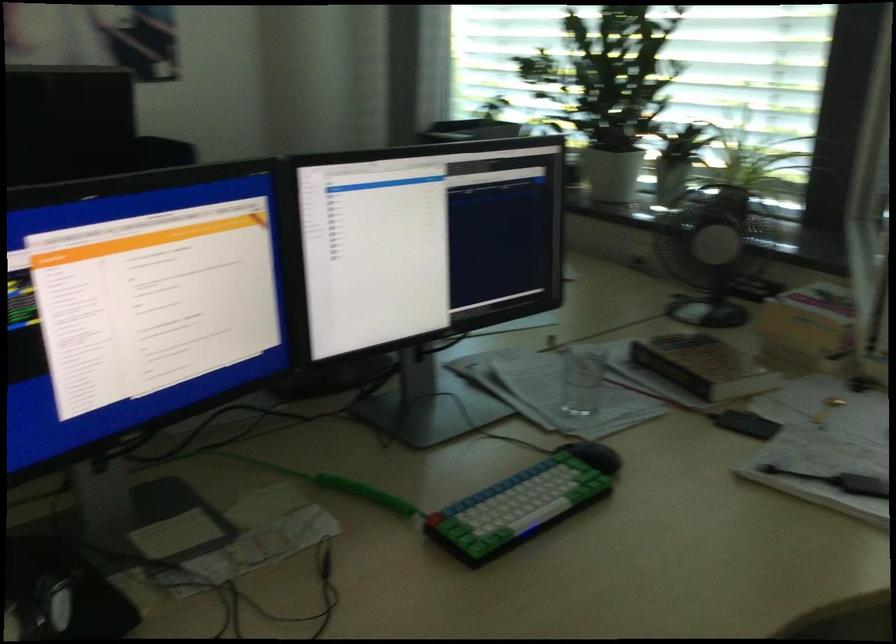
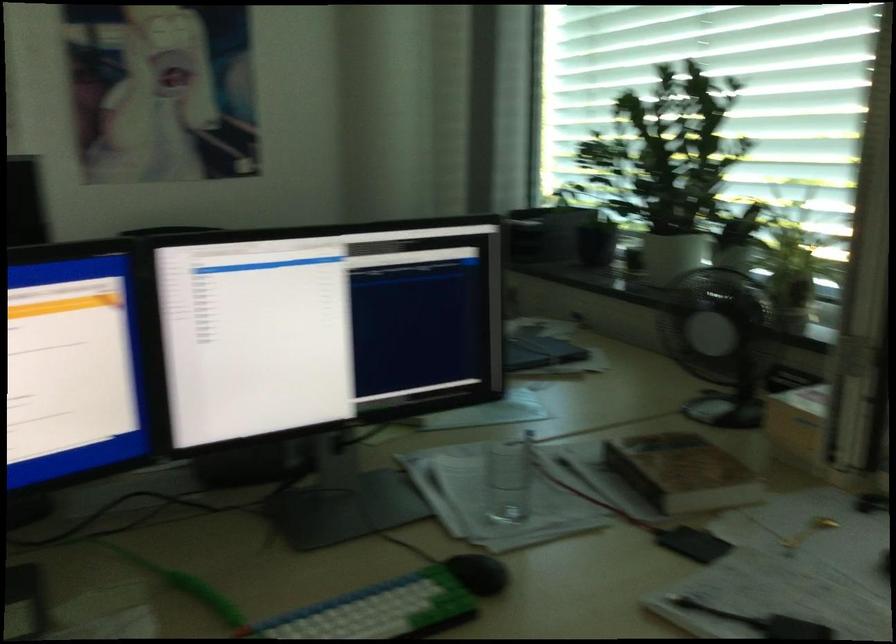
Question: Which direction would the cameraman need to move to produce the second image? Reply with the corresponding letter.

Choices:
 (A) Left
 (B) Right
 (C) Forward
 (D) Backward

Answer: (B)